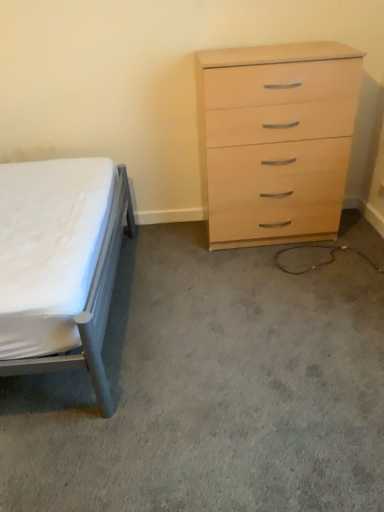
Locate an element on the screen. Image resolution: width=384 pixels, height=512 pixels. vacant area in front of light wood/veneer chest of drawers at right is located at coordinates (279, 280).